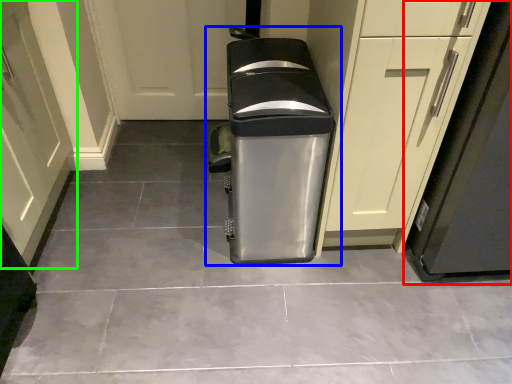
Question: Which object is positioned closest to appliance (highlighted by a red box)? Select from waste container (highlighted by a blue box) and door (highlighted by a green box).

Choices:
 (A) waste container
 (B) door

Answer: (A)